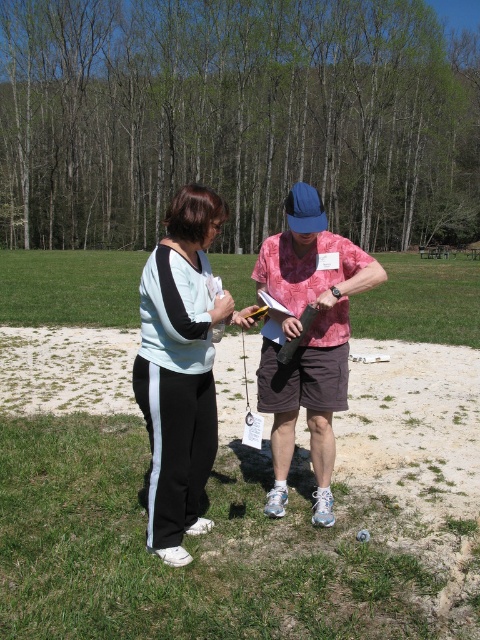
Between light blue cotton sweatshirt at center and pink tie-dye shirt at center, which one is positioned lower?

pink tie-dye shirt at center is below.

Is light blue cotton sweatshirt at center in front of pink tie-dye shirt at center?

Yes, light blue cotton sweatshirt at center is closer to the viewer.

Is point (159, 358) closer to camera compared to point (310, 291)?

That is True.

The height and width of the screenshot is (640, 480). I want to click on light blue cotton sweatshirt at center, so click(180, 369).